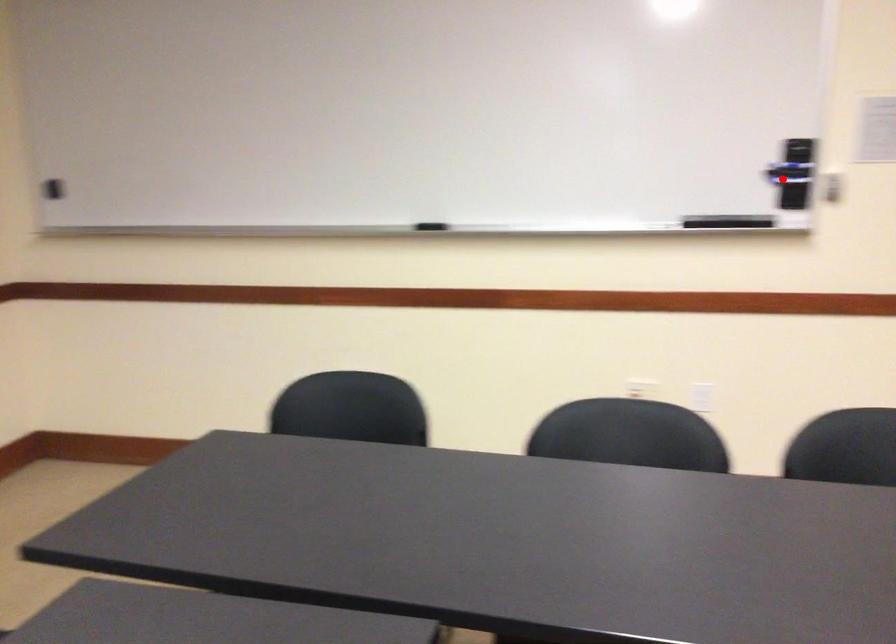
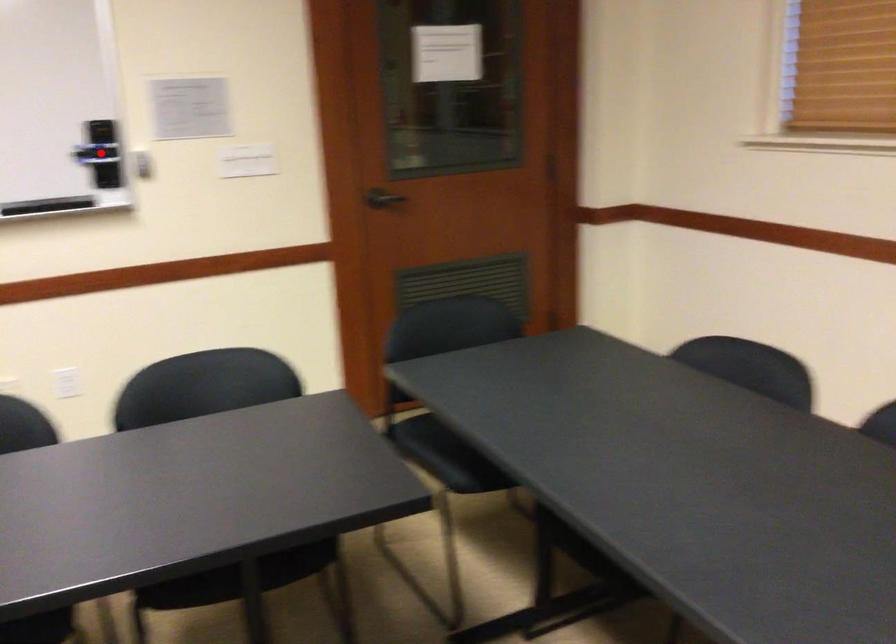
I am providing you with two images of the same scene from different viewpoints. A red point is marked on the first image and another point is marked on the second image. Is the red point in image1 aligned with the point shown in image2?

Yes